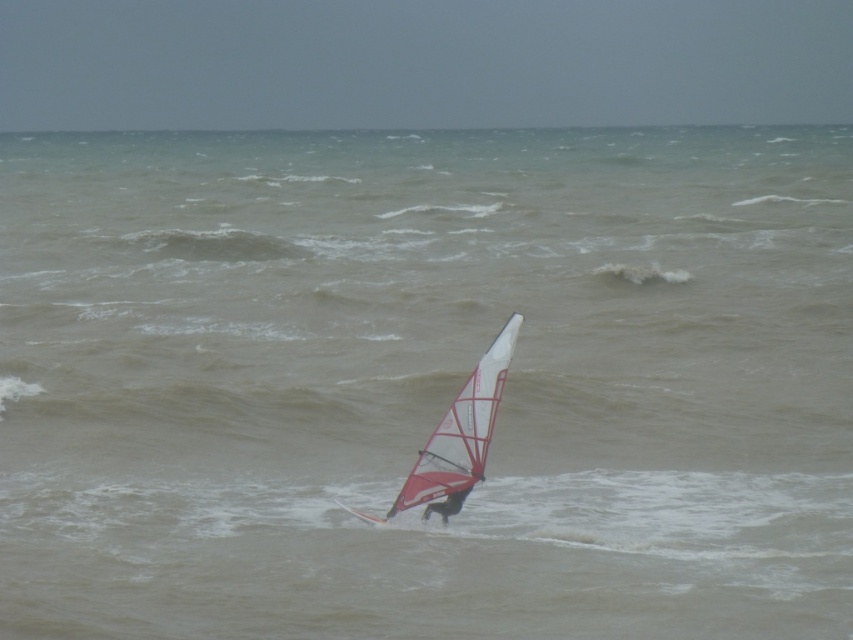
Based on the photo, you are a photographer trying to capture the windsurfer and their sail in a single shot. Given that your camera frame can only accommodate objects up to the size of the white matte sail at center, will the black fabric windsurfer at center fit within the frame if you focus on the sail?

The white matte sail at center is bigger than the black fabric windsurfer at center, so if the camera frame can accommodate the sail, the smaller windsurfer will also fit within the frame.

You are a sailor trying to navigate through the choppy waters in the scene. There is a point at coordinates point (457, 436) where a white matte sail at center is located. Can you safely maneuver your boat to avoid hitting the white matte sail at center?

The white matte sail at center is located at point (457, 436). Since the sail is part of the windsurfer in the scene, it is likely moving and not a fixed obstacle. You should adjust your course to avoid collision by steering away from the point (457, 436) where the white matte sail at center is situated.